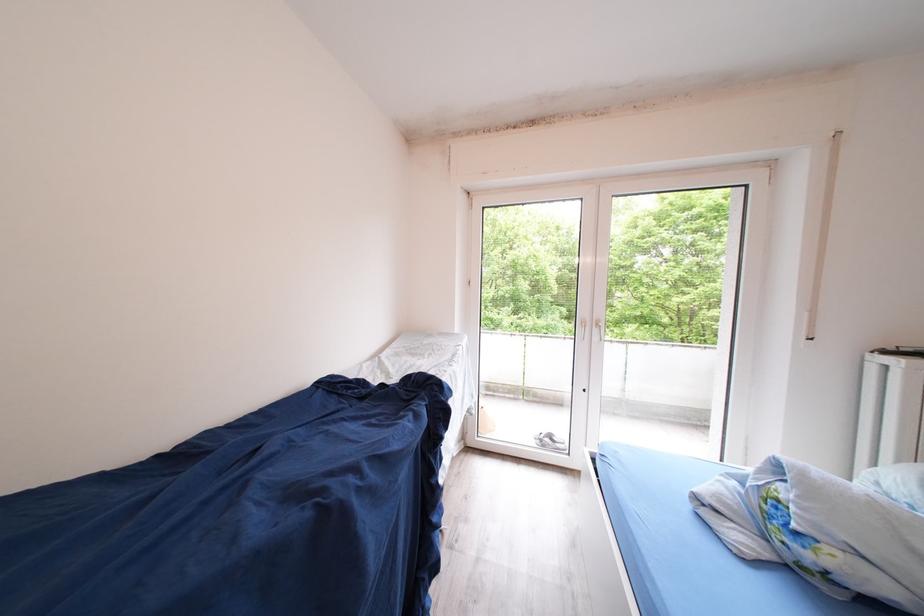
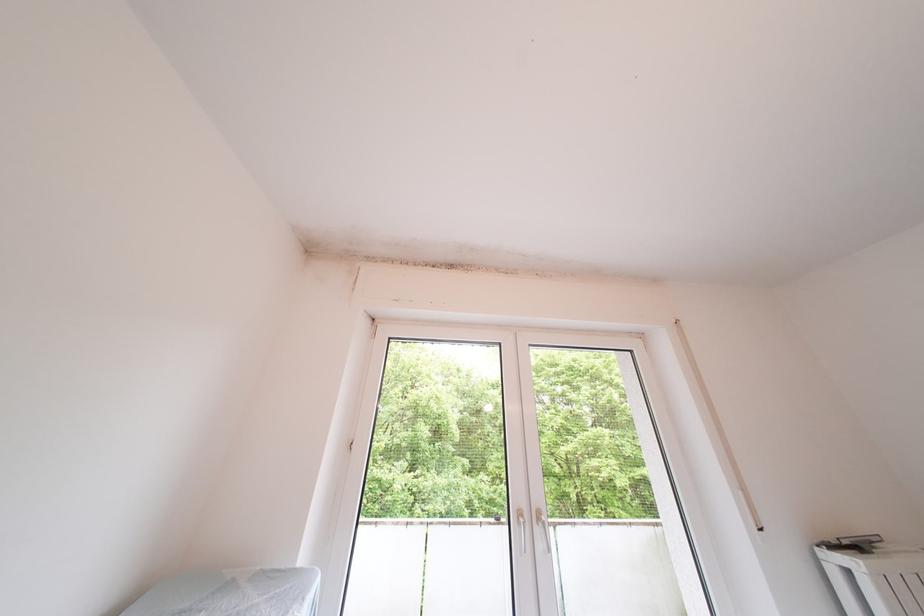
Where in the second image is the point corresponding to the point at 604,344 from the first image?

(550, 552)